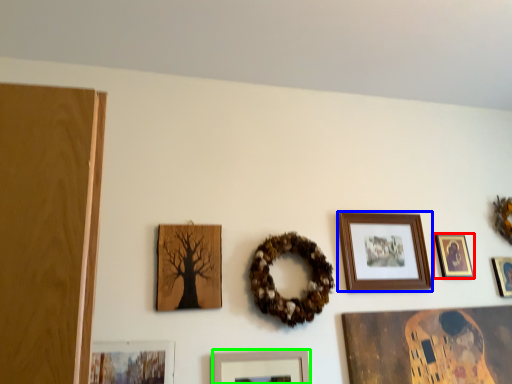
Question: Based on their relative distances, which object is nearer to picture frame (highlighted by a red box)? Choose from picture frame (highlighted by a blue box) and picture frame (highlighted by a green box).

Choices:
 (A) picture frame
 (B) picture frame

Answer: (A)